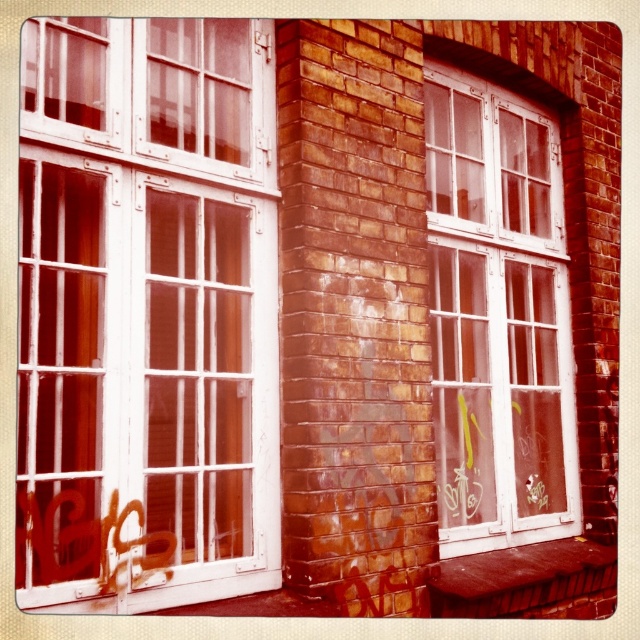
Question: Among these points, which one is farthest from the camera?

Choices:
 (A) (88, 497)
 (B) (582, 586)
 (C) (451, 257)

Answer: (C)

Question: Does white painted wood window frame at left come in front of brown wooden bench at lower right?

Choices:
 (A) no
 (B) yes

Answer: (B)

Question: Does white painted wood window frame at left have a larger size compared to white glass window at right?

Choices:
 (A) no
 (B) yes

Answer: (A)

Question: Which of the following is the farthest from the observer?

Choices:
 (A) (508, 525)
 (B) (150, 308)

Answer: (A)

Question: Which is farther from the white painted wood window frame at left?

Choices:
 (A) white glass window at right
 (B) brown wooden bench at lower right

Answer: (B)

Question: Is white glass window at right further to camera compared to brown wooden bench at lower right?

Choices:
 (A) yes
 (B) no

Answer: (A)